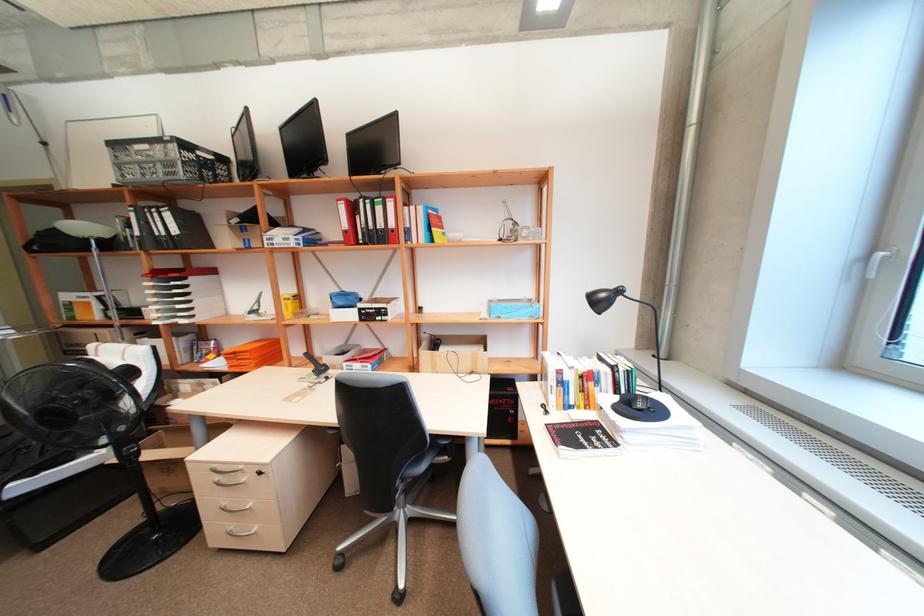
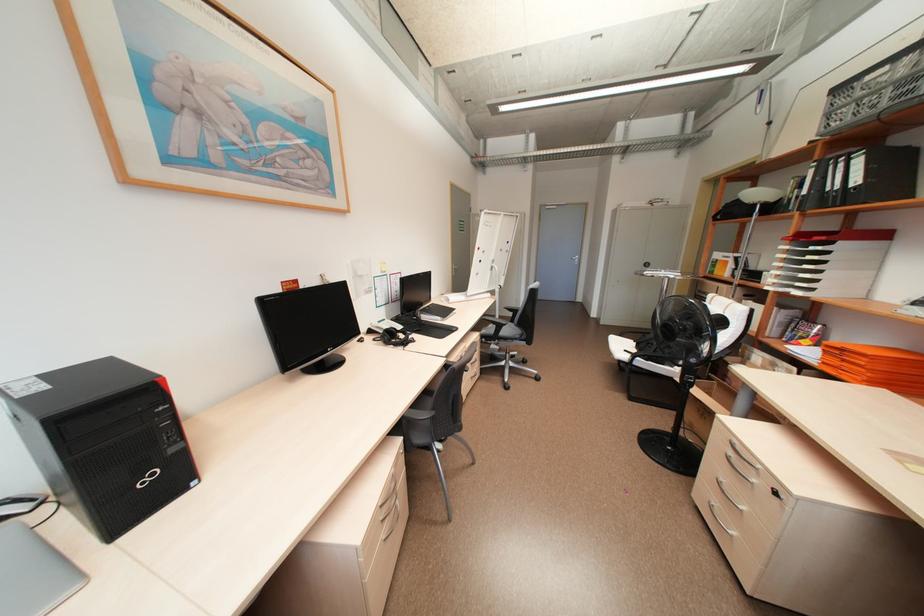
Find the pixel in the second image that matches point (142, 233) in the first image.

(810, 191)